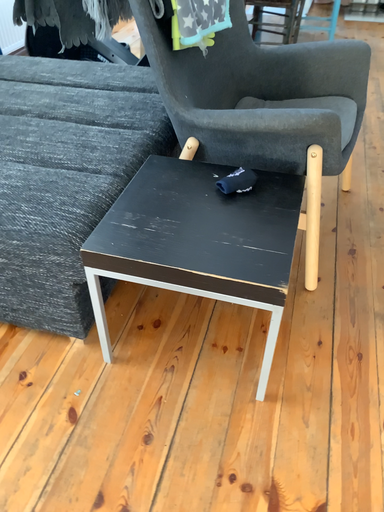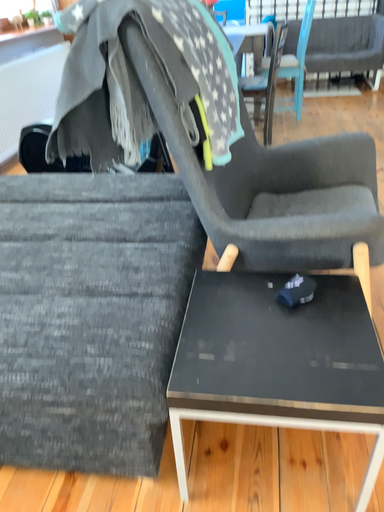
Question: Which way did the camera rotate in the video?

Choices:
 (A) rotated downward
 (B) rotated upward

Answer: (B)